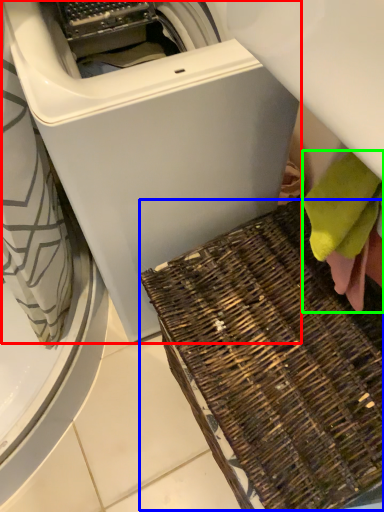
Question: Which object is positioned farthest from washing machine (highlighted by a red box)? Select from waste (highlighted by a blue box) and bath towel (highlighted by a green box).

Choices:
 (A) waste
 (B) bath towel

Answer: (B)